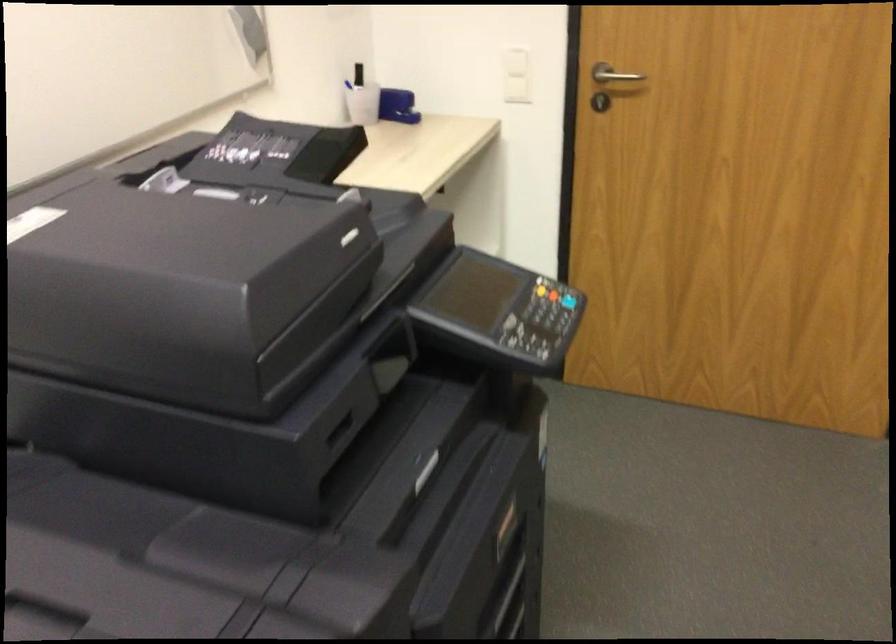
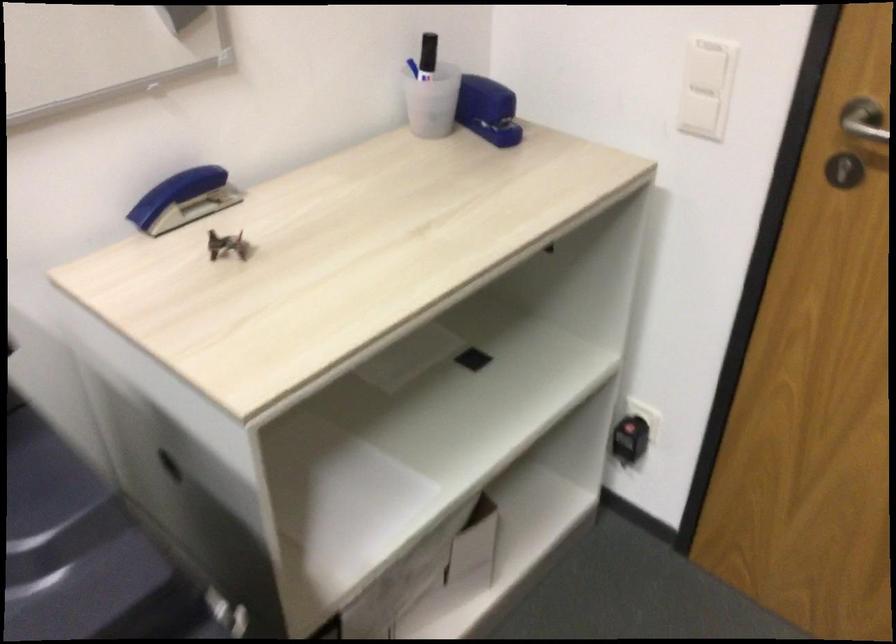
Question: I am providing you with two images of the same scene from different viewpoints. After the viewpoint changes to image2, which objects are now occluded?

Choices:
 (A) large blue stapler
 (B) silver door handle
 (C) blue pen
 (D) none of these

Answer: (D)